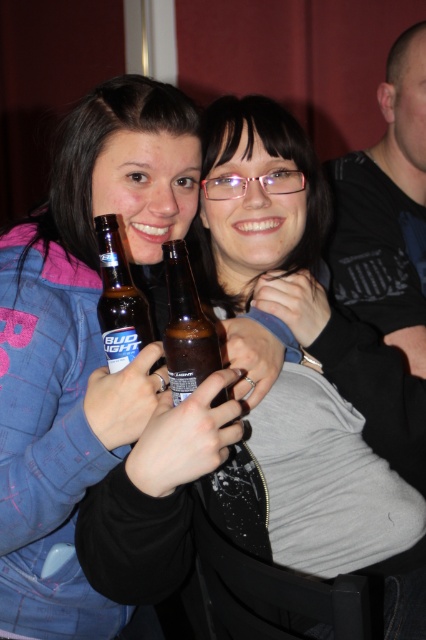
Question: Which point is closer to the camera?

Choices:
 (A) matte brown bottle at center
 (B) black cotton shirt at upper right
 (C) brown glass bottle at center
 (D) matte black jacket at center

Answer: (D)

Question: Is black cotton shirt at upper right positioned before matte brown bottle at center?

Choices:
 (A) no
 (B) yes

Answer: (A)

Question: Among these objects, which one is nearest to the camera?

Choices:
 (A) brown glass bottle at center
 (B) matte brown bottle at center
 (C) matte black jacket at center
 (D) black cotton shirt at upper right

Answer: (C)

Question: Where is black cotton shirt at upper right located in relation to matte brown bottle at center in the image?

Choices:
 (A) left
 (B) right

Answer: (B)

Question: Does matte black jacket at center appear under matte brown bottle at center?

Choices:
 (A) yes
 (B) no

Answer: (A)

Question: Which is farther from the matte black jacket at center?

Choices:
 (A) black cotton shirt at upper right
 (B) brown glass bottle at center

Answer: (A)